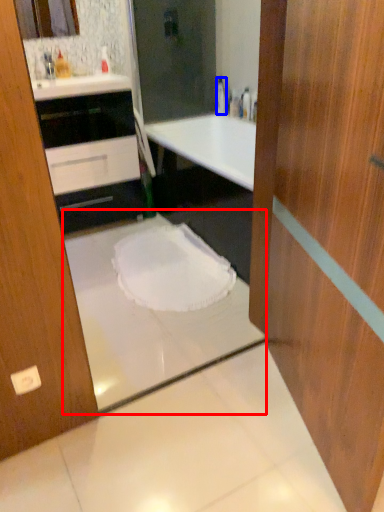
Question: Among these objects, which one is nearest to the camera, bath (highlighted by a red box) or bottle (highlighted by a blue box)?

Choices:
 (A) bath
 (B) bottle

Answer: (A)